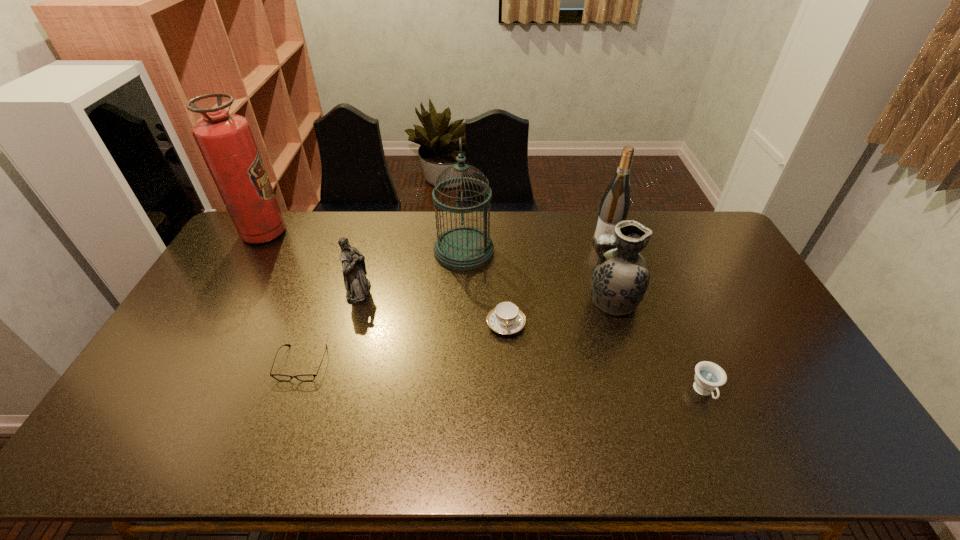
Where is `free space that is in between the birdcage and the farther teacup`? The height and width of the screenshot is (540, 960). free space that is in between the birdcage and the farther teacup is located at coordinates (485, 288).

This screenshot has width=960, height=540. Identify the location of unoccupied position between the right teacup and the shortest object. (503, 377).

Identify the location of vacant area that lies between the vase and the leftmost object. This screenshot has height=540, width=960. (438, 267).

At what (x,y) coordinates should I click in order to perform the action: click on empty space that is in between the spectacles and the farther teacup. Please return your answer as a coordinate pair (x, y). Image resolution: width=960 pixels, height=540 pixels. Looking at the image, I should click on (404, 343).

Find the location of a particular element. The width and height of the screenshot is (960, 540). vacant area that lies between the shortest object and the farther teacup is located at coordinates (404, 343).

Locate which object ranks fourth in proximity to the leftmost object. Please provide its 2D coordinates. Your answer should be formatted as a tuple, i.e. [(x, y)], where the tuple contains the x and y coordinates of a point satisfying the conditions above.

[(506, 318)]

Identify which object is the seventh nearest to the shortest object. Please provide its 2D coordinates. Your answer should be formatted as a tuple, i.e. [(x, y)], where the tuple contains the x and y coordinates of a point satisfying the conditions above.

[(709, 376)]

Where is `blank area in the image that satisfies the following two spatial constraints: 1. with the handle on the side of the vase; 2. on the front-facing side of the birdcage`? blank area in the image that satisfies the following two spatial constraints: 1. with the handle on the side of the vase; 2. on the front-facing side of the birdcage is located at coordinates (596, 251).

In order to click on vacant position in the image that satisfies the following two spatial constraints: 1. with the handle on the side of the vase; 2. on the front-facing side of the fifth tallest object in this screenshot , I will do `click(608, 292)`.